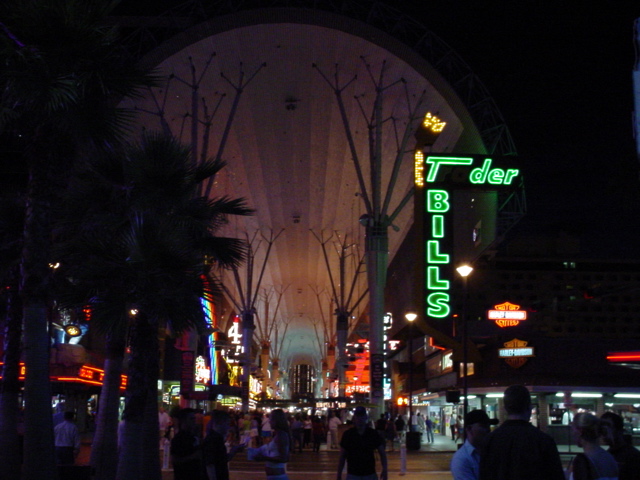
Identify the location of dinning. This screenshot has height=480, width=640. (100, 377), (233, 341).